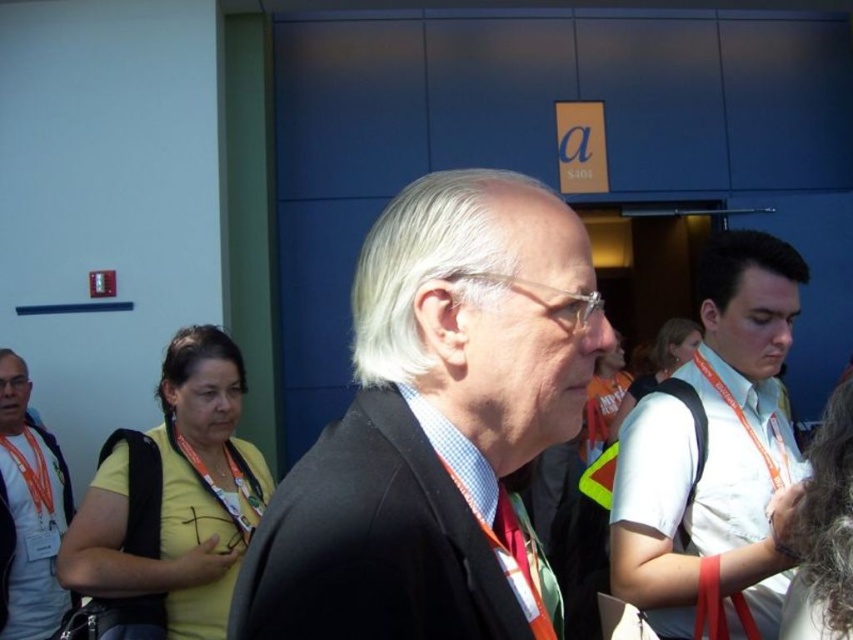
Question: Which of the following is the farthest from the observer?

Choices:
 (A) (755, 612)
 (B) (433, 300)

Answer: (A)

Question: Which is nearer to the orange lanyard at left?

Choices:
 (A) black suit at center
 (B) white shirt at right

Answer: (B)

Question: Does orange lanyard at left appear over black matte suit at center?

Choices:
 (A) yes
 (B) no

Answer: (B)

Question: Is white shirt at right wider than orange lanyard at left?

Choices:
 (A) yes
 (B) no

Answer: (A)

Question: Considering the relative positions of orange lanyard at left and black matte suit at center in the image provided, where is orange lanyard at left located with respect to black matte suit at center?

Choices:
 (A) below
 (B) above

Answer: (A)

Question: Which object appears farthest from the camera in this image?

Choices:
 (A) white shirt at right
 (B) orange lanyard at left
 (C) black suit at center
 (D) black matte suit at center

Answer: (B)